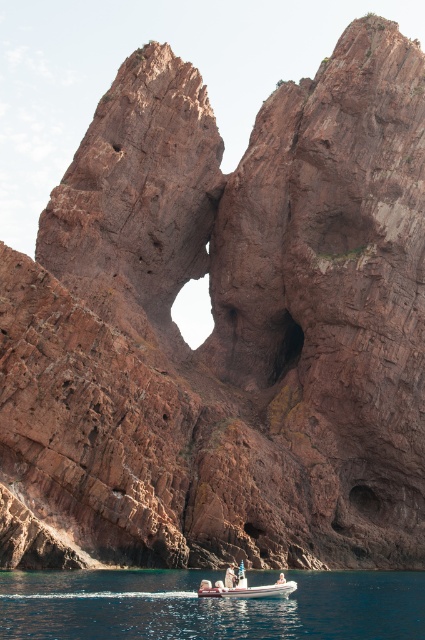
You are standing on a cliff overlooking the clear blue water at lower center. You want to throw a pebble into the water. Considering the distance between you and the water, do you think you can reach it with an average throwing distance of 30 meters?

The distance between you and the clear blue water at lower center is 38.22 meters, which is farther than your average throwing distance of 30 meters. Therefore, you cannot reach the water with a single throw.

You are a photographer positioned at the camera location. You want to capture a closeup shot of the point at coordinates point (198, 625). Given that your current lens has a focal length of 50mm, which allows you to focus on objects 50 meters away, will you need a different lens to achieve a sharp closeup of that point?

The point at coordinates point (198, 625) is 46.45 meters away from the camera. Since your current lens focuses at 50 meters, which is farther than the required distance, you would need a lens with a shorter focal length to focus on closer objects. Alternatively, you could adjust your camera settings or use a lens with a focal length around 46.45 meters for precise focus.

You are a photographer planning to take a picture of the rock formation. You notice two points marked on your map at coordinates point (110, 584) and point (229, 566). Which point should you stand closer to in order to capture the heart shape of the rock formation more prominently in your photo?

You should stand closer to point (110, 584) because it is closer to the viewer, allowing for a more prominent display of the heart shape in the rock formation compared to point (229, 566).